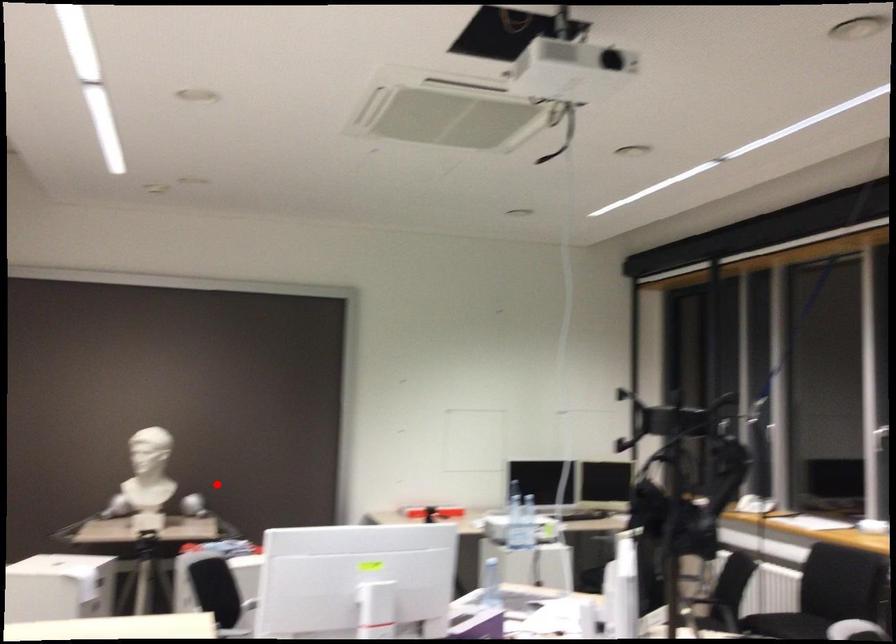
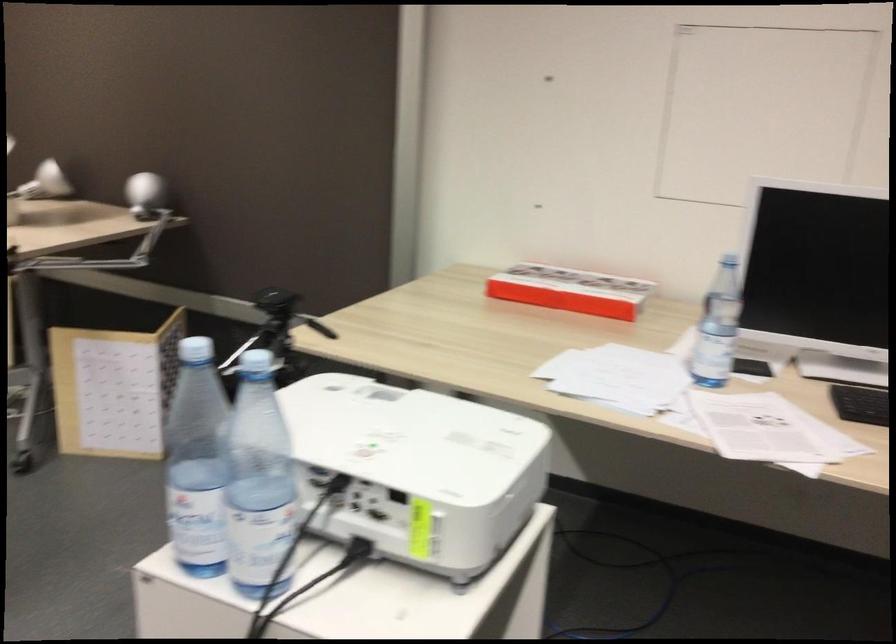
Question: I am providing you with two images of the same scene from different viewpoints. A red point is shown in image1. For the corresponding object point in image2, is it positioned nearer or farther from the camera?

Choices:
 (A) Nearer
 (B) Farther

Answer: (A)